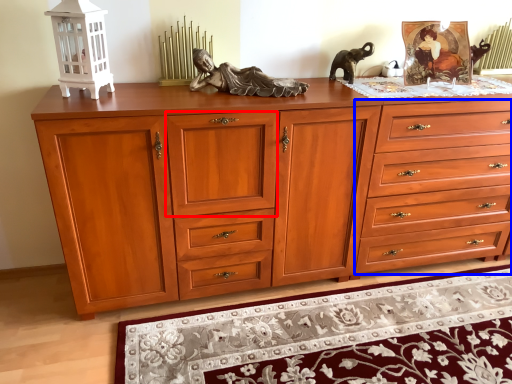
Question: Which object is closer to the camera taking this photo, drawer (highlighted by a red box) or drawer (highlighted by a blue box)?

Choices:
 (A) drawer
 (B) drawer

Answer: (A)